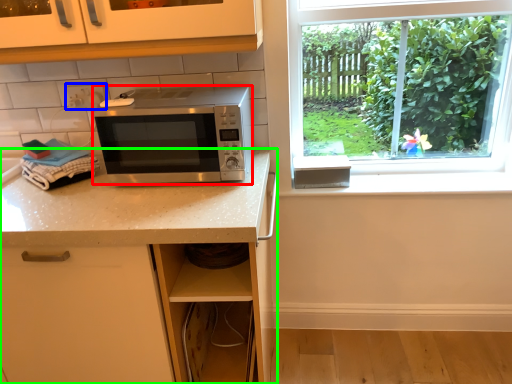
Question: Considering the real-world distances, which object is farthest from microwave oven (highlighted by a red box)? electric outlet (highlighted by a blue box) or countertop (highlighted by a green box)?

Choices:
 (A) electric outlet
 (B) countertop

Answer: (A)